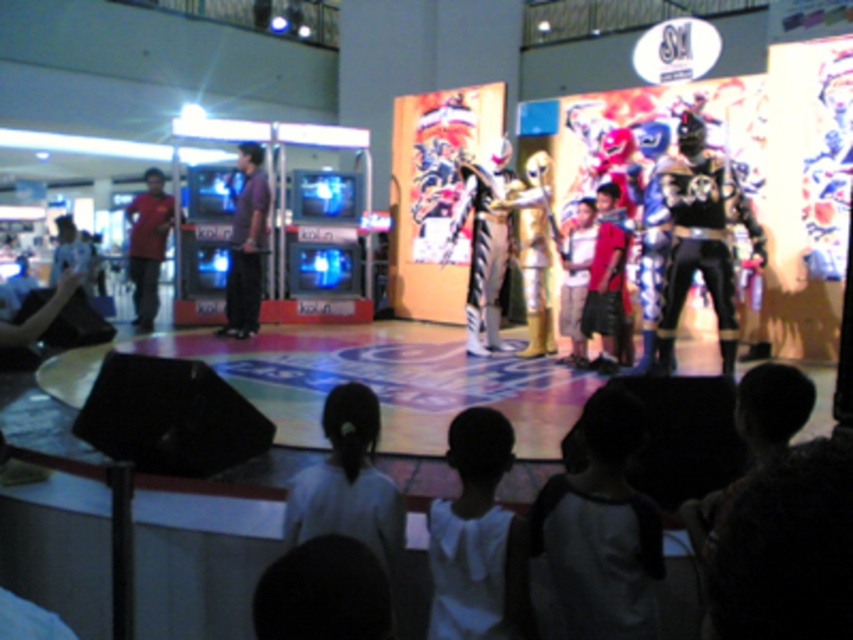
Question: Is purple shirt at left smaller than matte red shirt at left?

Choices:
 (A) no
 (B) yes

Answer: (B)

Question: Which object is farther from the camera taking this photo?

Choices:
 (A) black metallic armor at center
 (B) purple shirt at left
 (C) white fabric shirt at lower center

Answer: (B)

Question: Based on their relative distances, which object is farther from the white fabric shirt at lower center?

Choices:
 (A) matte red shirt at left
 (B) black metallic armor at center
 (C) purple shirt at left

Answer: (A)

Question: Does black metallic armor at center have a smaller size compared to matte red shirt at left?

Choices:
 (A) yes
 (B) no

Answer: (A)

Question: Which point is farther from the camera taking this photo?

Choices:
 (A) (680, 256)
 (B) (460, 548)

Answer: (A)

Question: Is black metallic armor at center further to camera compared to purple shirt at left?

Choices:
 (A) no
 (B) yes

Answer: (A)